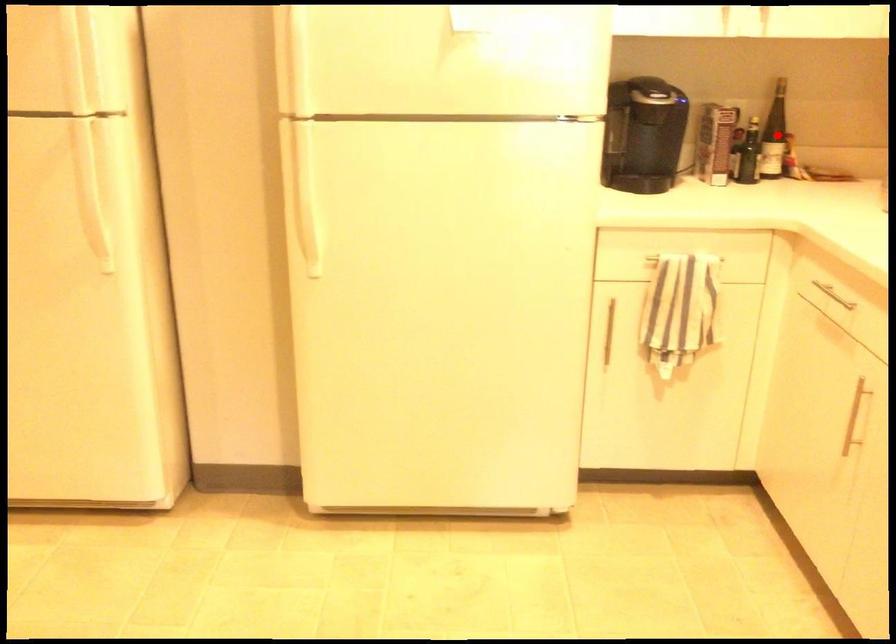
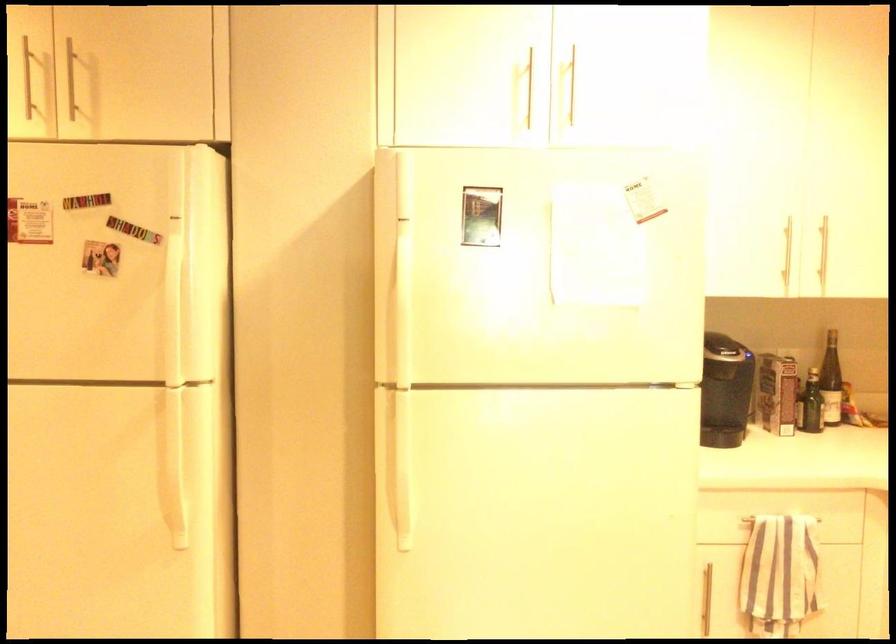
Question: I am providing you with two images of the same scene from different viewpoints. A red point is marked on the first image. At the location where the point appears in image 1, is it still visible in image 2?

Choices:
 (A) Yes
 (B) No

Answer: (A)